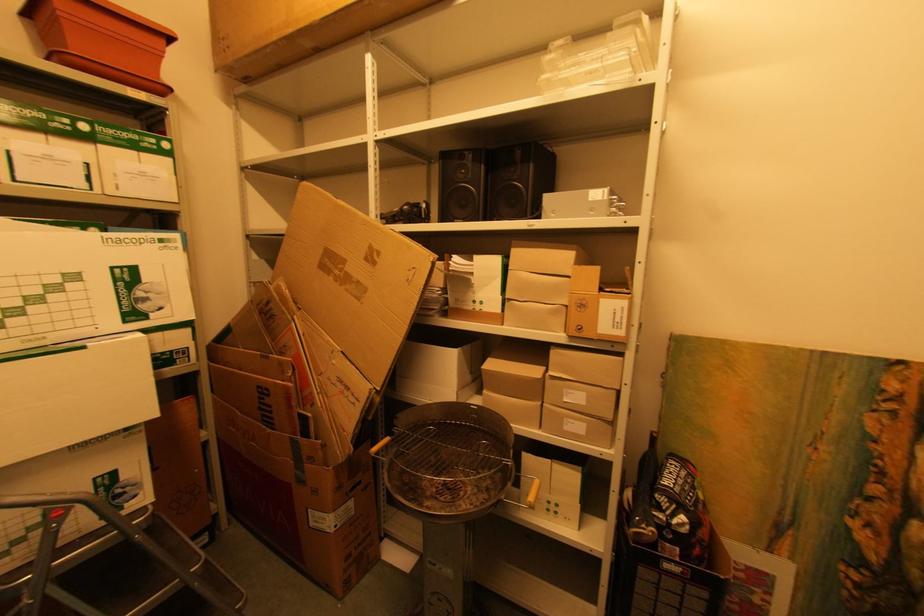
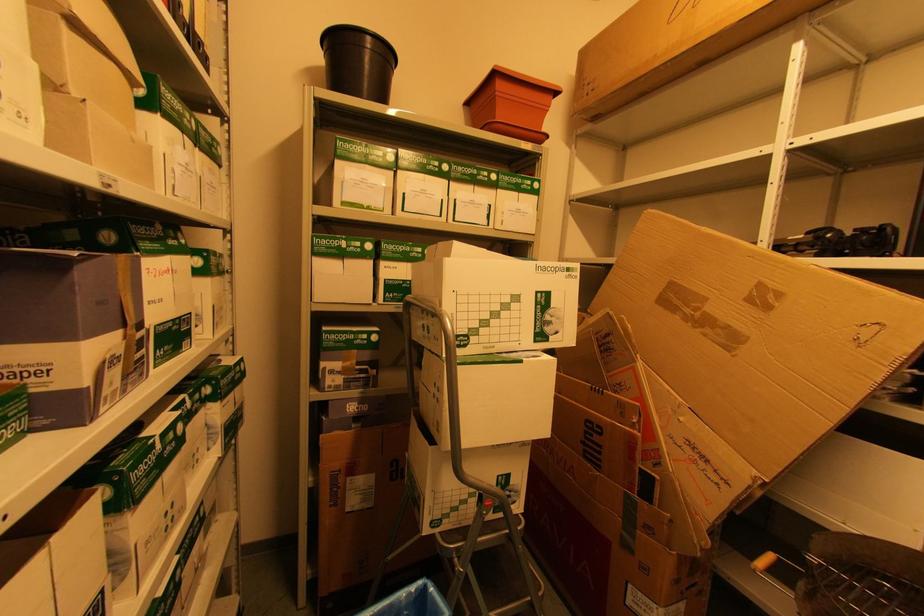
Question: The first image is from the beginning of the video and the second image is from the end. How did the camera likely rotate when shooting the video?

Choices:
 (A) Left
 (B) Right
 (C) Up
 (D) Down

Answer: (A)